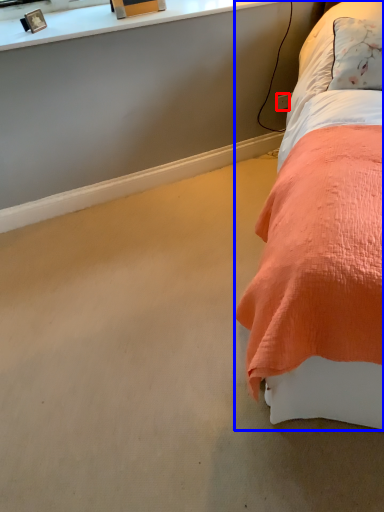
Question: Which object is closer to the camera taking this photo, power outlet (highlighted by a red box) or bed (highlighted by a blue box)?

Choices:
 (A) power outlet
 (B) bed

Answer: (B)